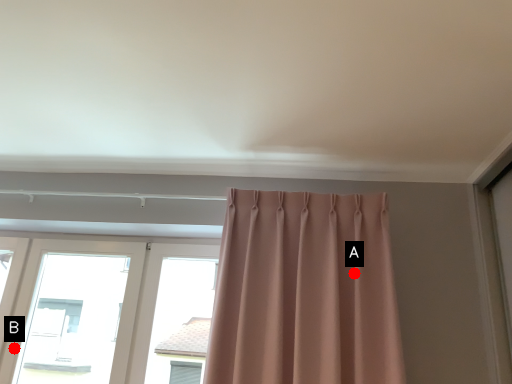
Question: Two points are circled on the image, labeled by A and B beside each circle. Which point is closer to the camera?

Choices:
 (A) A is closer
 (B) B is closer

Answer: (A)